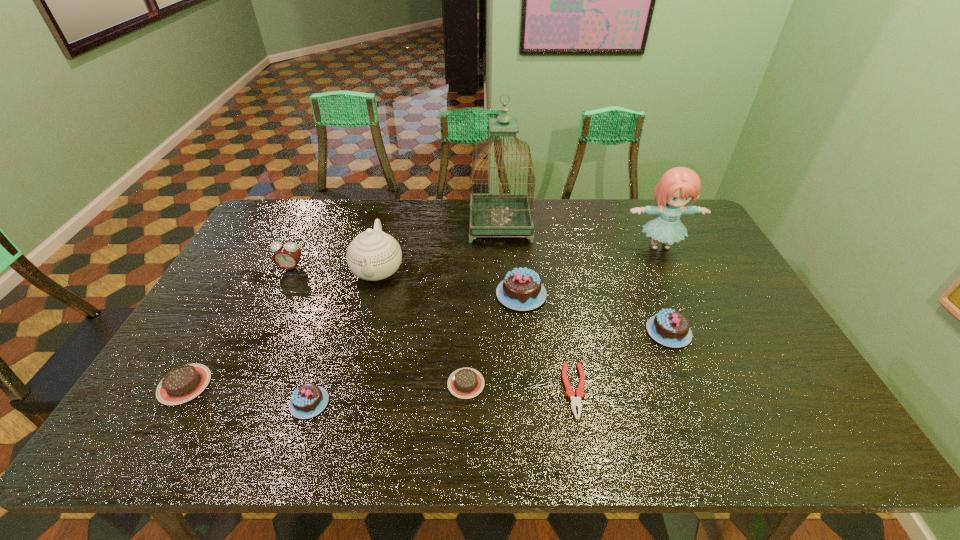
This screenshot has width=960, height=540. I want to click on the sixth tallest object, so click(671, 328).

Where is `the third shortest chocolate cake`? The height and width of the screenshot is (540, 960). the third shortest chocolate cake is located at coordinates (308, 400).

Where is `the second chocolate cake from left to right`? This screenshot has width=960, height=540. the second chocolate cake from left to right is located at coordinates (308, 400).

Find the location of a particular element. the left brown chocolate cake is located at coordinates (181, 384).

You are a GUI agent. You are given a task and a screenshot of the screen. Output one action in this format:
    pyautogui.click(x=<x>, y=<y>)
    Task: Click on the fourth tallest chocolate cake
    Image resolution: width=960 pixels, height=540 pixels.
    Given the screenshot: What is the action you would take?
    pyautogui.click(x=181, y=384)

Identify the location of the shortest chocolate cake. coord(465,383).

Locate an element on the screen. the right brown chocolate cake is located at coordinates pos(465,383).

In order to click on the eighth object from left to right in this screenshot , I will do `click(570, 393)`.

What are the coordinates of `pliers` in the screenshot? It's located at (570, 393).

The width and height of the screenshot is (960, 540). Find the location of `free space located at the door of the greenish birdcage`. free space located at the door of the greenish birdcage is located at coordinates (427, 225).